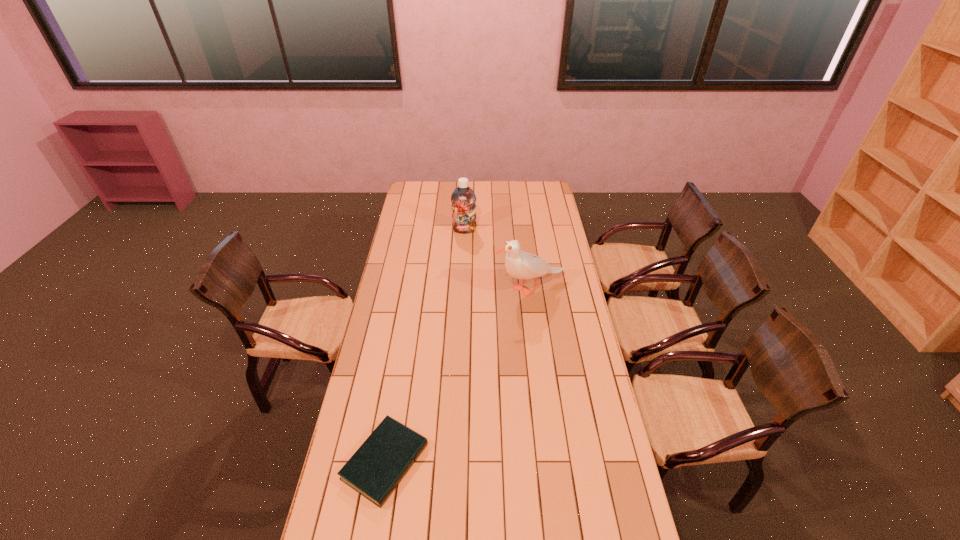
I want to click on free space between the farthest object and the book, so click(424, 346).

Image resolution: width=960 pixels, height=540 pixels. I want to click on blank region between the leftmost object and the gull, so click(x=458, y=375).

Where is `free space between the farthest object and the leftmost object`? free space between the farthest object and the leftmost object is located at coordinates (424, 346).

Locate an element on the screen. Image resolution: width=960 pixels, height=540 pixels. vacant space in between the second object from left to right and the shortest object is located at coordinates (424, 346).

Where is `empty space that is in between the rightmost object and the second object from left to right`? empty space that is in between the rightmost object and the second object from left to right is located at coordinates (497, 260).

The image size is (960, 540). In order to click on vacant area that lies between the nearest object and the second object from left to right in this screenshot , I will do `click(424, 346)`.

Identify the location of free spot between the second farthest object and the farthest object. The image size is (960, 540). (497, 260).

The width and height of the screenshot is (960, 540). Find the location of `the closest object relative to the shortest object`. the closest object relative to the shortest object is located at coordinates (521, 265).

The height and width of the screenshot is (540, 960). Find the location of `object that is the closest to the nearest object`. object that is the closest to the nearest object is located at coordinates (521, 265).

Locate an element on the screen. This screenshot has width=960, height=540. vacant space that satisfies the following two spatial constraints: 1. at the beak of the second nearest object; 2. on the front side of the nearest object is located at coordinates point(552,462).